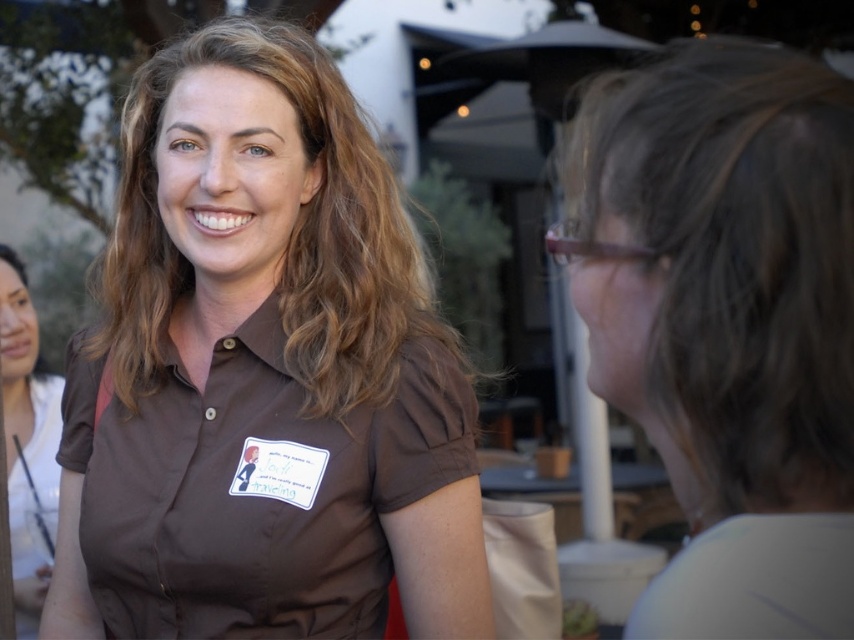
You are at a social gathering and see the gray matte hair at right and the matte brown shirt at left. Which object is closer to you?

The gray matte hair at right is closer to you because it is in front of the matte brown shirt at left.

You are a photographer at this event and need to adjust the lighting to ensure both the gray matte hair at right and the brown wavy hair at center are well lit. Which hair style should you focus on first to account for their size?

The gray matte hair at right is shorter than the brown wavy hair at center, so you should focus on the gray matte hair at right first since shorter hair might require more precise lighting adjustments to highlight its details.

You are a photographer at the event and need to position two subjects in a way that their features are clearly visible. The gray matte hair at right and the matte brown shirt at left are your subjects. Given their positions and the lighting, which subject should you focus on first to ensure both are in sharp focus?

The gray matte hair at right is shorter than the matte brown shirt at left, so focusing on the matte brown shirt at left first will ensure both subjects are in sharp focus as it is farther away and requires a smaller depth of field.